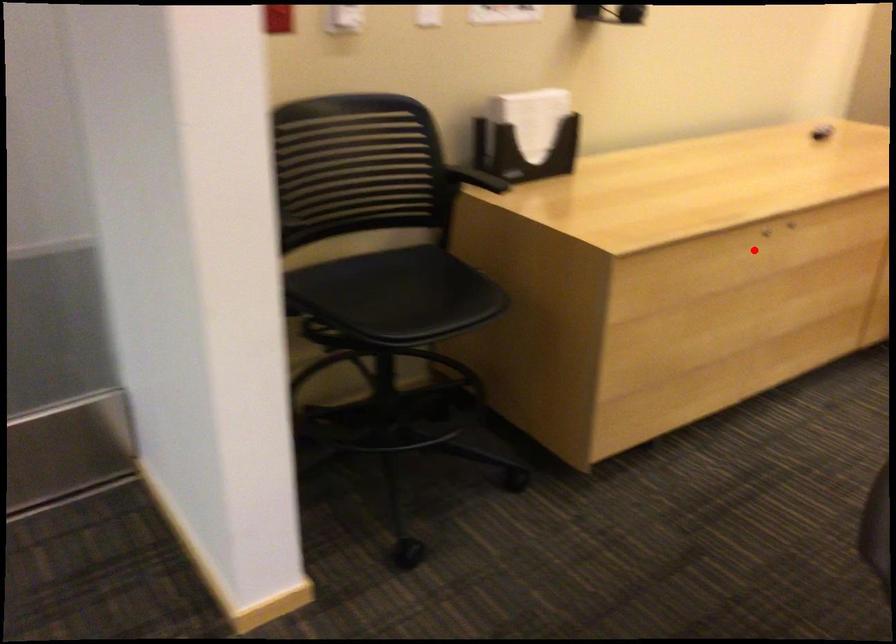
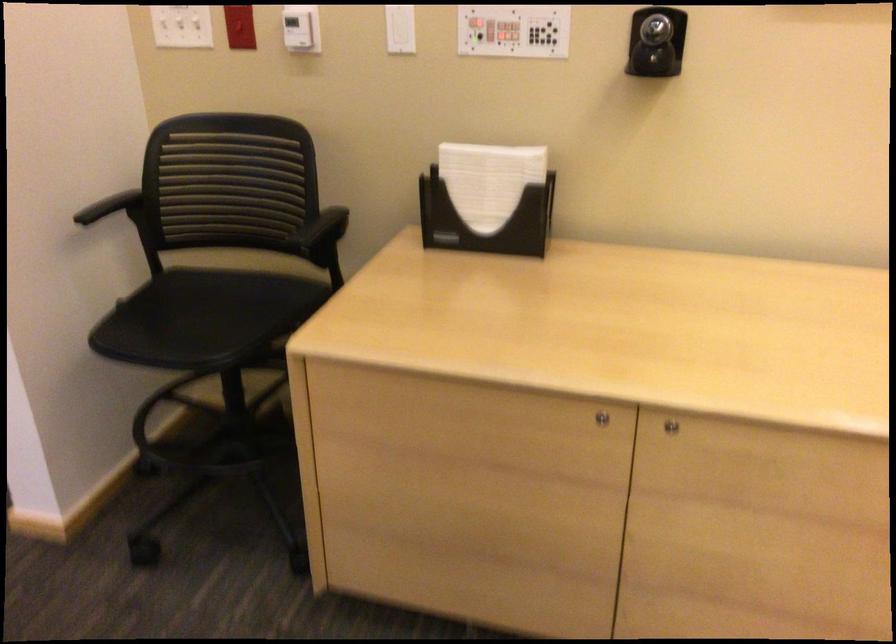
Question: I am providing you with two images of the same scene from different viewpoints. Image1 has a red point marked. In image2, the corresponding 3D location appears at what relative position? Reply with the corresponding letter.

Choices:
 (A) Closer
 (B) Farther

Answer: (A)